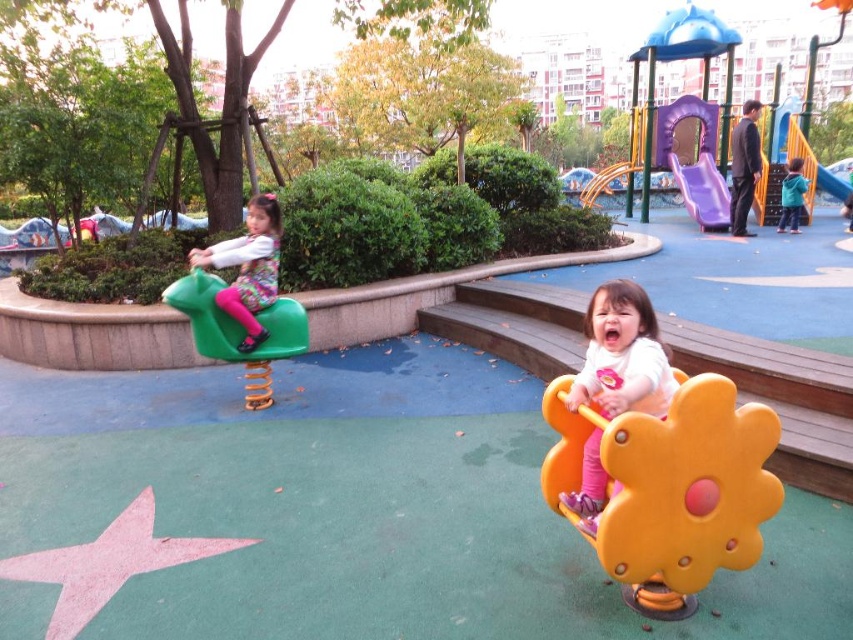
Can you confirm if green plastic seesaw at left is positioned below smooth plastic slide at upper right?

Yes.

Does green plastic seesaw at left have a greater width compared to smooth plastic slide at upper right?

No, green plastic seesaw at left is not wider than smooth plastic slide at upper right.

This screenshot has width=853, height=640. Identify the location of green plastic seesaw at left. (239, 332).

Can you confirm if green plastic seesaw at left is smaller than teal matte jacket at right?

Indeed, green plastic seesaw at left has a smaller size compared to teal matte jacket at right.

Who is positioned more to the left, green plastic seesaw at left or teal matte jacket at right?

From the viewer's perspective, green plastic seesaw at left appears more on the left side.

Describe the element at coordinates (239, 332) in the screenshot. I see `green plastic seesaw at left` at that location.

Locate an element on the screen. This screenshot has width=853, height=640. green plastic seesaw at left is located at coordinates (239, 332).

Is matte floral dress at left positioned behind teal matte jacket at right?

No, matte floral dress at left is in front of teal matte jacket at right.

Between point (253, 228) and point (799, 173), which one is positioned in front?

Positioned in front is point (253, 228).

Does point (242, 280) lie in front of point (798, 228)?

Yes, point (242, 280) is in front of point (798, 228).

You are a GUI agent. You are given a task and a screenshot of the screen. Output one action in this format:
    pyautogui.click(x=<x>, y=<y>)
    Task: Click on the matte floral dress at left
    The image size is (853, 640).
    Given the screenshot: What is the action you would take?
    pyautogui.click(x=248, y=268)